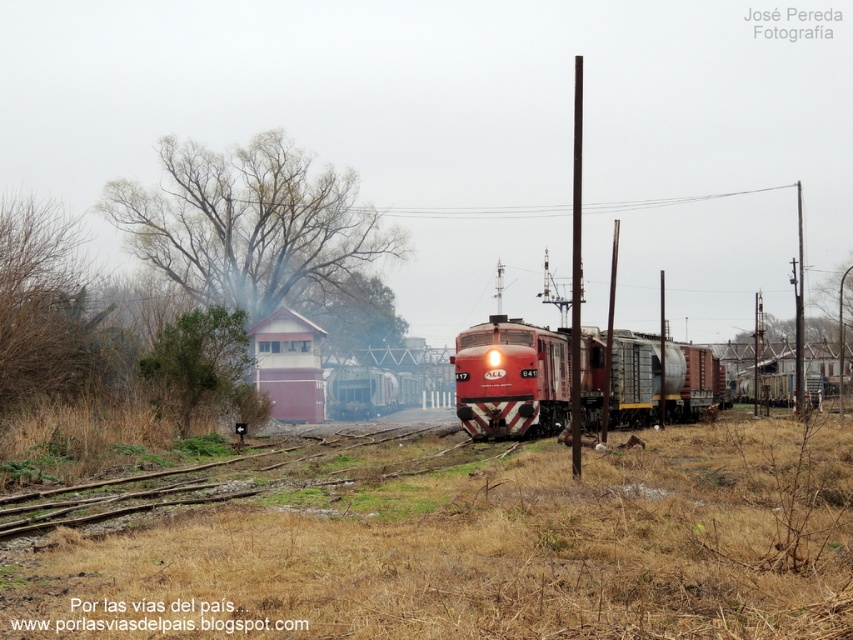
Question: Among these points, which one is farthest from the camera?

Choices:
 (A) (585, 349)
 (B) (316, 448)

Answer: (A)

Question: Among these points, which one is farthest from the camera?

Choices:
 (A) (689, 349)
 (B) (341, 480)

Answer: (A)

Question: Does matte red train at center appear on the right side of wooden track at lower left?

Choices:
 (A) no
 (B) yes

Answer: (B)

Question: Is matte red train at center smaller than wooden track at lower left?

Choices:
 (A) yes
 (B) no

Answer: (B)

Question: Can you confirm if matte red train at center is positioned to the right of wooden track at lower left?

Choices:
 (A) yes
 (B) no

Answer: (A)

Question: Which point appears farthest from the camera in this image?

Choices:
 (A) (456, 342)
 (B) (209, 468)

Answer: (A)